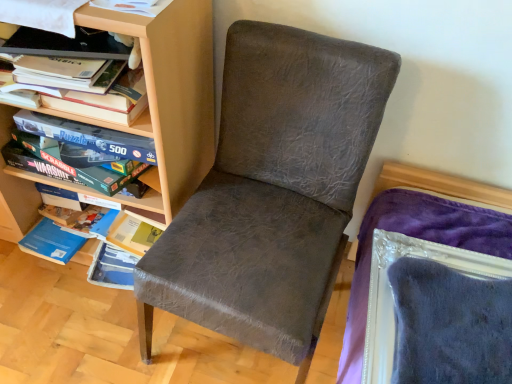
Question: Is matte wood shelf at left shorter than matte gray chair at center?

Choices:
 (A) no
 (B) yes

Answer: (A)

Question: Is matte gray chair at center located within matte wood shelf at left?

Choices:
 (A) yes
 (B) no

Answer: (B)

Question: Considering the relative sizes of matte wood shelf at left and matte gray chair at center in the image provided, is matte wood shelf at left bigger than matte gray chair at center?

Choices:
 (A) no
 (B) yes

Answer: (B)

Question: Can you confirm if matte wood shelf at left is positioned to the left of matte gray chair at center?

Choices:
 (A) yes
 (B) no

Answer: (A)

Question: From a real-world perspective, does matte wood shelf at left sit lower than matte gray chair at center?

Choices:
 (A) yes
 (B) no

Answer: (B)

Question: Based on their positions, is matte wood shelf at left located to the left or right of matte gray chair at center?

Choices:
 (A) left
 (B) right

Answer: (A)

Question: Is matte wood shelf at left in front of or behind matte gray chair at center in the image?

Choices:
 (A) front
 (B) behind

Answer: (B)

Question: From a real-world perspective, is matte wood shelf at left physically located above or below matte gray chair at center?

Choices:
 (A) below
 (B) above

Answer: (B)

Question: Considering the positions of matte wood shelf at left and matte gray chair at center in the image, is matte wood shelf at left wider or thinner than matte gray chair at center?

Choices:
 (A) thin
 (B) wide

Answer: (A)

Question: In terms of size, does matte wood shelf at left appear bigger or smaller than hardcover book at upper left?

Choices:
 (A) big
 (B) small

Answer: (A)

Question: Is point (169, 220) closer or farther from the camera than point (36, 76)?

Choices:
 (A) closer
 (B) farther

Answer: (B)

Question: From the image's perspective, is matte wood shelf at left located above or below hardcover book at upper left?

Choices:
 (A) below
 (B) above

Answer: (A)

Question: Is matte wood shelf at left inside the boundaries of hardcover book at upper left, or outside?

Choices:
 (A) outside
 (B) inside

Answer: (A)

Question: Would you say hardcover book at upper left is inside or outside matte wood shelf at left?

Choices:
 (A) outside
 (B) inside

Answer: (B)

Question: Considering the positions of hardcover book at upper left and matte wood shelf at left in the image, is hardcover book at upper left taller or shorter than matte wood shelf at left?

Choices:
 (A) short
 (B) tall

Answer: (A)